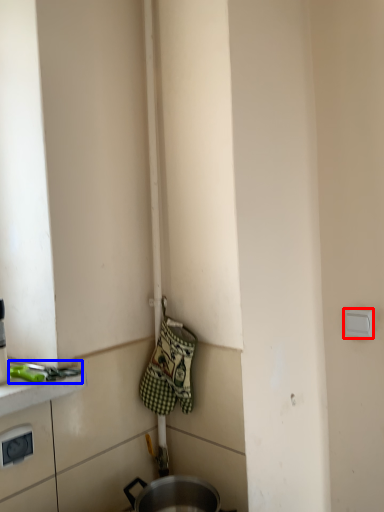
Question: Which object is further to the camera taking this photo, electric outlet (highlighted by a red box) or tool (highlighted by a blue box)?

Choices:
 (A) electric outlet
 (B) tool

Answer: (A)